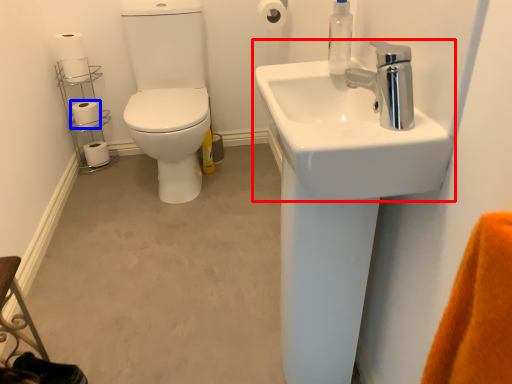
Question: Which object appears closest to the camera in this image, sink (highlighted by a red box) or toilet paper (highlighted by a blue box)?

Choices:
 (A) sink
 (B) toilet paper

Answer: (A)